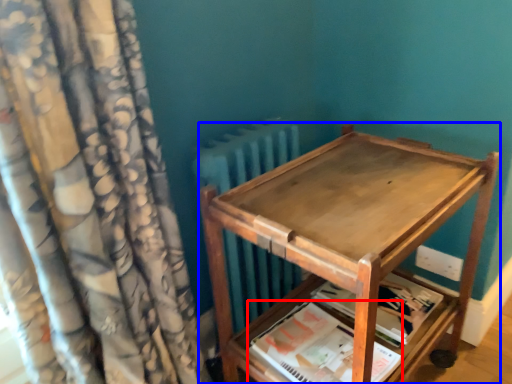
Question: Which object appears closest to the camera in this image, paperback book (highlighted by a red box) or furniture (highlighted by a blue box)?

Choices:
 (A) paperback book
 (B) furniture

Answer: (B)